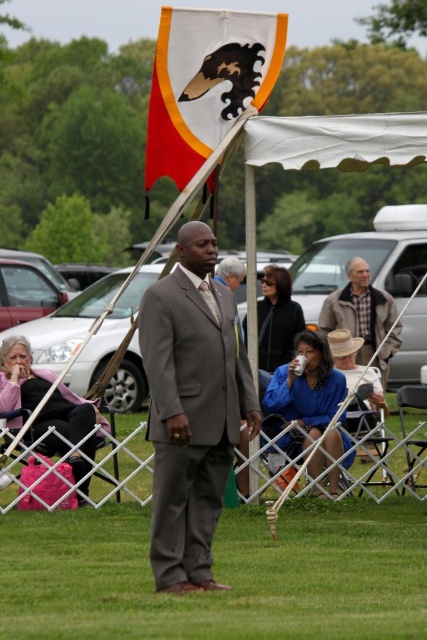
You are a photographer at the event and want to capture a photo that includes both the pink fabric bag at lower left and the plaid wool jacket at center. Based on their positions, which object should be placed on the left side of the photo to ensure both are visible?

The pink fabric bag at lower left should be placed on the left side of the photo since it is to the left of the plaid wool jacket at center.

You are a photographer at the event and want to capture a photo that includes both the matte gray suit at center and the blue fabric shirt at lower center. Which object should you focus on first to ensure both are in sharp focus?

You should focus on the matte gray suit at center first because it is closer to the viewer than the blue fabric shirt at lower center, so focusing on the closer object will keep both in focus if the depth of field is sufficient.